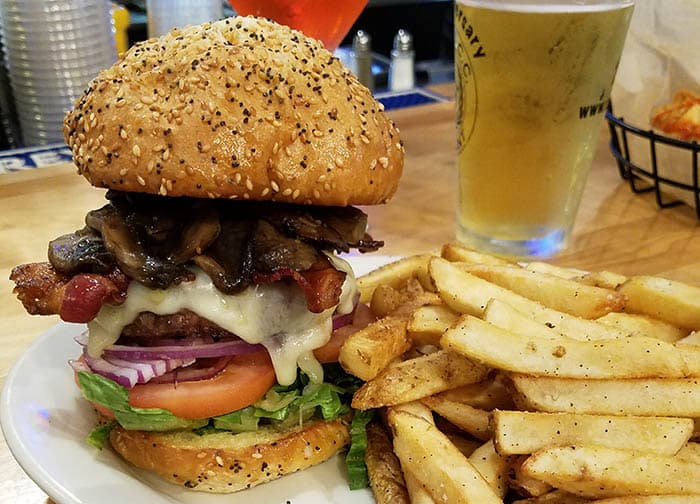
At what (x,y) coordinates should I click in order to perform the action: click on pepper shaker. Please return your answer as a coordinate pair (x, y). This screenshot has height=504, width=700. Looking at the image, I should click on (356, 57).